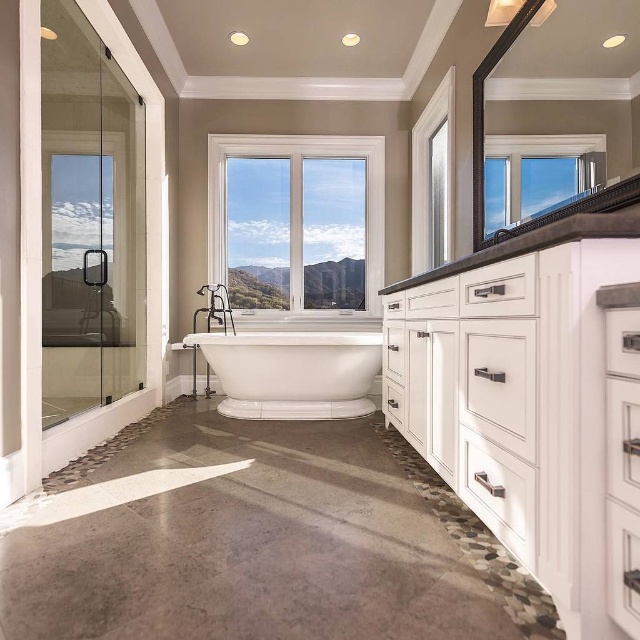
Between white matte cabinet at right and clear glass window at upper center, which one is positioned higher?

clear glass window at upper center is higher up.

Is white matte cabinet at right to the right of clear glass window at upper center from the viewer's perspective?

→ No, white matte cabinet at right is not to the right of clear glass window at upper center.

I want to click on white matte cabinet at right, so click(518, 387).

Locate an element on the screen. The width and height of the screenshot is (640, 640). white matte cabinet at right is located at coordinates (518, 387).

Who is positioned more to the right, white matte cabinet at right or white glossy bathtub at center?

From the viewer's perspective, white matte cabinet at right appears more on the right side.

Is white matte cabinet at right above white glossy bathtub at center?

Yes.

This screenshot has width=640, height=640. Describe the element at coordinates (518, 387) in the screenshot. I see `white matte cabinet at right` at that location.

In order to click on white matte cabinet at right in this screenshot , I will do `click(518, 387)`.

Is clear glass window at center thinner than white glossy bathtub at center?

In fact, clear glass window at center might be wider than white glossy bathtub at center.

Who is more distant from viewer, (216, 275) or (284, 371)?

The point (216, 275) is more distant.

You are a GUI agent. You are given a task and a screenshot of the screen. Output one action in this format:
    pyautogui.click(x=<x>, y=<y>)
    Task: Click on the clear glass window at center
    
    Given the screenshot: What is the action you would take?
    pyautogui.click(x=296, y=224)